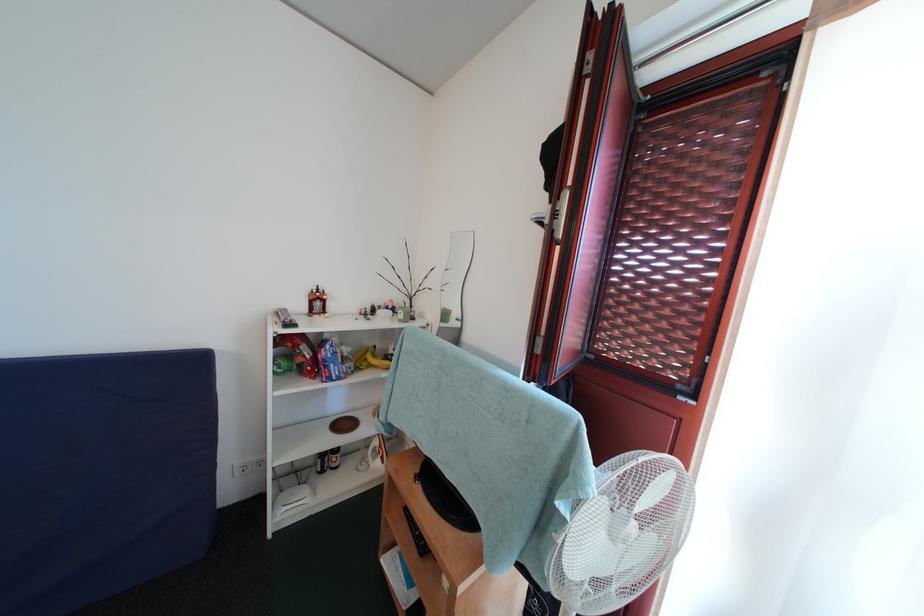
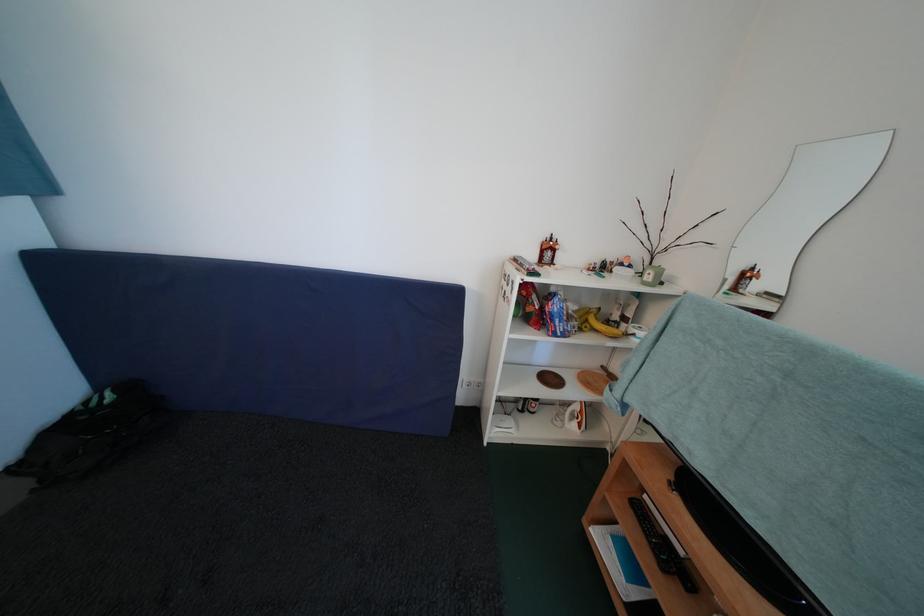
Question: The camera is either moving clockwise (left) or counter-clockwise (right) around the object. The first image is from the beginning of the video and the second image is from the end. Is the camera moving left or right when shooting the video?

Choices:
 (A) Left
 (B) Right

Answer: (B)